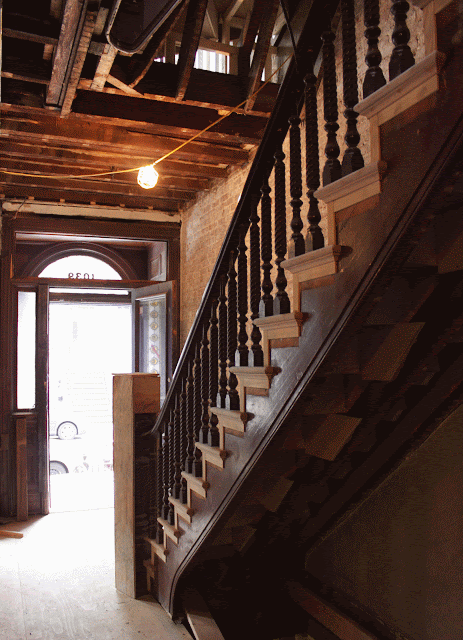
You are a GUI agent. You are given a task and a screenshot of the screen. Output one action in this format:
    pyautogui.click(x=<x>, y=<y>)
    Task: Click on the brick wall
    
    Given the screenshot: What is the action you would take?
    pyautogui.click(x=217, y=230)